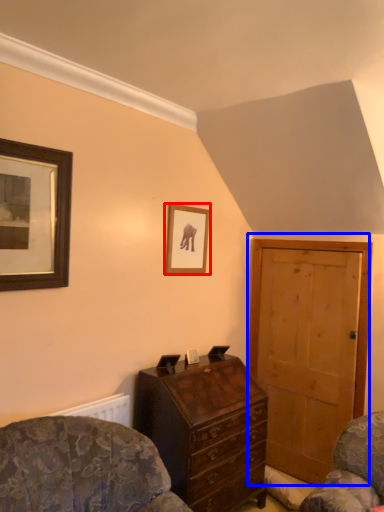
Question: Among these objects, which one is nearest to the camera, picture frame (highlighted by a red box) or door (highlighted by a blue box)?

Choices:
 (A) picture frame
 (B) door

Answer: (A)